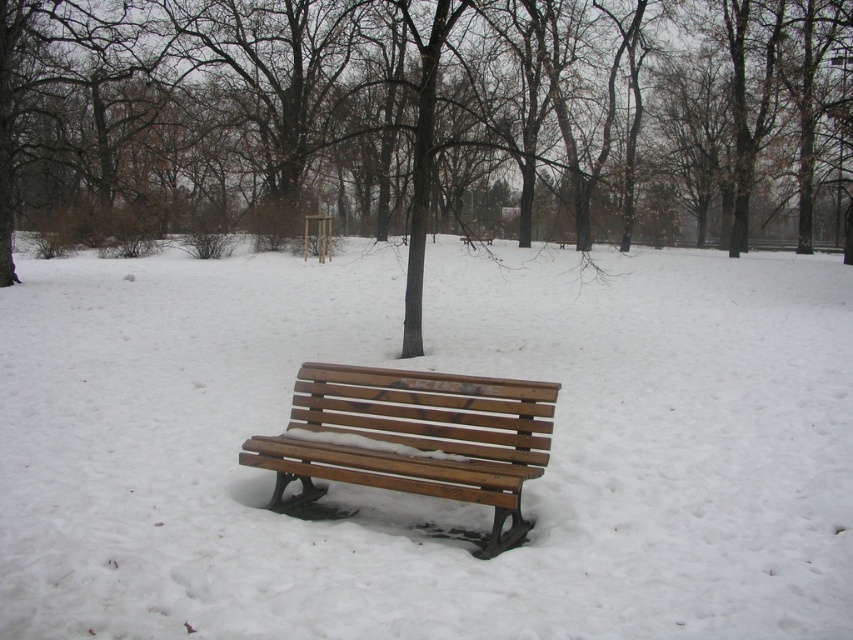
You are standing at the point closer to the camera in the winter scene. Which point are you at, point (581, 168) or point (410, 456)?

You are at point (410, 456) because it is closer to the camera than point (581, 168).

You are planning to place a small birdhouse on either the brown wood tree at center or the wooden bench at center. Based on their sizes, which object would be more suitable for mounting the birdhouse?

The brown wood tree at center is much taller than the wooden bench at center, so it would be more suitable for mounting the birdhouse as it provides a higher and stable structure.